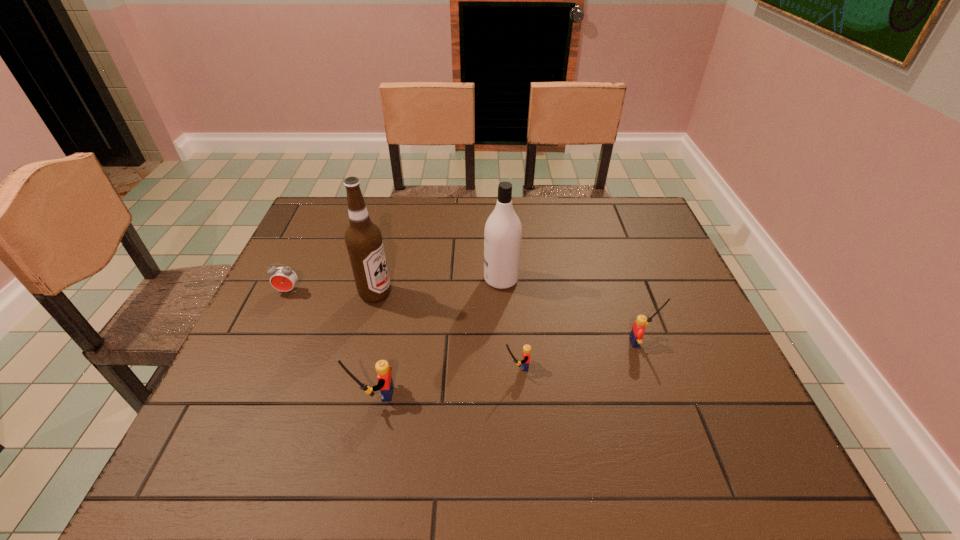
The width and height of the screenshot is (960, 540). I want to click on the leftmost Lego, so click(x=385, y=383).

Identify the location of the nearest Lego. The width and height of the screenshot is (960, 540). (385, 383).

Find the location of a particular element. The width and height of the screenshot is (960, 540). the shortest Lego is located at coordinates (525, 362).

This screenshot has width=960, height=540. What are the coordinates of `the second nearest object` in the screenshot? It's located at (525, 362).

Identify the location of the rightmost Lego. (638, 328).

Identify the location of the second tallest Lego. Image resolution: width=960 pixels, height=540 pixels. (638, 328).

At what (x,y) coordinates should I click in order to perform the action: click on alcohol. Please return your answer as a coordinate pair (x, y). Looking at the image, I should click on (363, 238).

Locate an element on the screen. This screenshot has height=540, width=960. shampoo is located at coordinates (503, 231).

Image resolution: width=960 pixels, height=540 pixels. What are the coordinates of `alarm clock` in the screenshot? It's located at (284, 279).

This screenshot has width=960, height=540. I want to click on free space located on the front-facing side of the fourth shortest object, so click(326, 394).